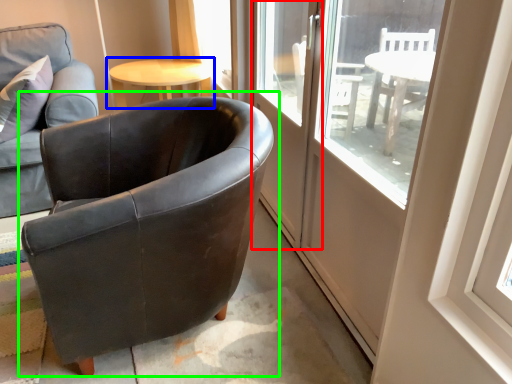
Question: Which is farther away from screen door (highlighted by a red box)? table (highlighted by a blue box) or chair (highlighted by a green box)?

Choices:
 (A) table
 (B) chair

Answer: (A)